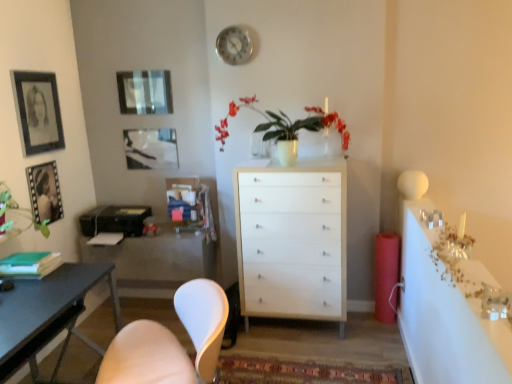
What do you see at coordinates (145, 92) in the screenshot?
I see `matte glass picture frame at upper center, the 3th picture frame positioned from the left` at bounding box center [145, 92].

Measure the distance between matte glass picture frame at upper center, the 3th picture frame positioned from the left, and camera.

matte glass picture frame at upper center, the 3th picture frame positioned from the left, is 3.05 meters away from camera.

In order to face black matte picture frame at upper left, which appears as the first picture frame when viewed from the left, should I rotate leftwards or rightwards?

Rotate your view left by about 26.527°.

The width and height of the screenshot is (512, 384). What do you see at coordinates (284, 123) in the screenshot?
I see `white glossy vase at center` at bounding box center [284, 123].

In order to click on matte white picture frame at upper left, the 1th picture frame from the right in this screenshot , I will do `click(150, 148)`.

Looking at this image, from a real-world perspective, is white matte chair at lower left physically below white glossy vase at center?

Indeed, from a real-world perspective, white matte chair at lower left is positioned beneath white glossy vase at center.

Is white matte chair at lower left taller or shorter than white glossy vase at center?

Clearly, white matte chair at lower left is taller compared to white glossy vase at center.

Looking at this image, is white matte chair at lower left thinner than white glossy vase at center?

Incorrect, the width of white matte chair at lower left is not less than that of white glossy vase at center.

Considering the points (140, 339) and (256, 108), which point is behind, point (140, 339) or point (256, 108)?

The point (256, 108) is farther from the camera.

Which is behind, point (287, 285) or point (122, 93)?

Point (122, 93)

From a real-world perspective, is white wood chest of drawers at center under matte glass picture frame at upper center, the 3th picture frame positioned from the left?

Yes, from a real-world perspective, white wood chest of drawers at center is beneath matte glass picture frame at upper center, the 3th picture frame positioned from the left.

From the image's perspective, which is below, white wood chest of drawers at center or matte glass picture frame at upper center, the 3th picture frame positioned from the left?

white wood chest of drawers at center is shown below in the image.

Does white wood chest of drawers at center appear on the right side of matte glass picture frame at upper center, the 3th picture frame positioned from the left?

Correct, you'll find white wood chest of drawers at center to the right of matte glass picture frame at upper center, the 3th picture frame positioned from the left.

Looking at this image, how many degrees apart are the facing directions of white glossy vase at center and matte glass picture frame at upper center, the 3th picture frame positioned from the left?

They differ by 0.0299 degrees in their facing directions.

Considering the sizes of objects white glossy vase at center and matte glass picture frame at upper center, the second picture frame from the right, in the image provided, who is smaller, white glossy vase at center or matte glass picture frame at upper center, the second picture frame from the right,?

matte glass picture frame at upper center, the second picture frame from the right, is smaller.

From a real-world perspective, which object stands above the other?

matte glass picture frame at upper center, the second picture frame from the right, from a real-world perspective.

From the image's perspective, is white glossy vase at center positioned above or below matte glass picture frame at upper center, the second picture frame from the right?

Clearly, from the image's perspective, white glossy vase at center is below matte glass picture frame at upper center, the second picture frame from the right.

From the image's perspective, is white glossy vase at center located beneath matte black picture frame at left, the 3th picture frame viewed from the right?

Actually, white glossy vase at center appears above matte black picture frame at left, the 3th picture frame viewed from the right, in the image.

In terms of size, does white glossy vase at center appear bigger or smaller than matte black picture frame at left, marked as the second picture frame in a left-to-right arrangement?

white glossy vase at center is bigger than matte black picture frame at left, marked as the second picture frame in a left-to-right arrangement.

How distant is white glossy vase at center from matte black picture frame at left, the 3th picture frame viewed from the right?

The distance of white glossy vase at center from matte black picture frame at left, the 3th picture frame viewed from the right, is 4.56 feet.

From a real-world perspective, who is located lower, white glossy vase at center or matte black picture frame at left, the 3th picture frame viewed from the right?

In real-world perspective, matte black picture frame at left, the 3th picture frame viewed from the right, is lower.

Can you tell me how much matte black picture frame at left, the 3th picture frame viewed from the right, and matte glass picture frame at upper center, the 3th picture frame positioned from the left, differ in facing direction?

90 degrees separate the facing orientations of matte black picture frame at left, the 3th picture frame viewed from the right, and matte glass picture frame at upper center, the 3th picture frame positioned from the left.

From the image's perspective, is matte black picture frame at left, marked as the second picture frame in a left-to-right arrangement, under matte glass picture frame at upper center, the 3th picture frame positioned from the left?

Yes.

Is matte black picture frame at left, the 3th picture frame viewed from the right, at the right side of matte glass picture frame at upper center, the second picture frame from the right?

In fact, matte black picture frame at left, the 3th picture frame viewed from the right, is to the left of matte glass picture frame at upper center, the second picture frame from the right.

How distant is matte black picture frame at left, marked as the second picture frame in a left-to-right arrangement, from matte glass picture frame at upper center, the second picture frame from the right?

The distance of matte black picture frame at left, marked as the second picture frame in a left-to-right arrangement, from matte glass picture frame at upper center, the second picture frame from the right, is 32.23 inches.

Does white glossy vase at center have a greater height compared to matte white picture frame at upper left, the 1th picture frame from the right?

Yes.

In terms of width, does white glossy vase at center look wider or thinner when compared to matte white picture frame at upper left, the 1th picture frame from the right?

In the image, white glossy vase at center appears to be wider than matte white picture frame at upper left, the 1th picture frame from the right.

Can we say white glossy vase at center lies outside matte white picture frame at upper left, which appears as the fourth picture frame when viewed from the left?

That's correct, white glossy vase at center is outside of matte white picture frame at upper left, which appears as the fourth picture frame when viewed from the left.

Which is behind, point (271, 120) or point (141, 164)?

The point (141, 164) is farther.

Find the location of `desk below the white wood chest of drawers at center (from a real-world perspective)`. desk below the white wood chest of drawers at center (from a real-world perspective) is located at coordinates (47, 310).

Between white wood chest of drawers at center and black metal desk at lower left, which one has more height?

Standing taller between the two is white wood chest of drawers at center.

Could you tell me if white wood chest of drawers at center is turned towards black metal desk at lower left?

No.

Locate an element on the screen. houseplant above the white matte chair at lower left (from a real-world perspective) is located at coordinates (284, 123).

Where is `the chest of drawers that appears below the matte glass picture frame at upper center, the second picture frame from the right (from the image's perspective)`? the chest of drawers that appears below the matte glass picture frame at upper center, the second picture frame from the right (from the image's perspective) is located at coordinates (293, 240).

Estimate the real-world distances between objects in this image. Which object is closer to white glossy countertop at right, white wood chest of drawers at center or metallic silver clock at upper center?

white wood chest of drawers at center lies closer to white glossy countertop at right than the other object.

Based on their spatial positions, is matte white picture frame at upper left, which appears as the fourth picture frame when viewed from the left, or matte black picture frame at left, marked as the second picture frame in a left-to-right arrangement, further from metallic silver clock at upper center?

matte black picture frame at left, marked as the second picture frame in a left-to-right arrangement, lies further to metallic silver clock at upper center than the other object.

Which object lies further to the anchor point black metal desk at lower left, matte glass picture frame at upper center, the second picture frame from the right, or white glossy countertop at right?

The object further to black metal desk at lower left is white glossy countertop at right.

Looking at this image, estimate the real-world distances between objects in this image. Which object is further from matte white picture frame at upper left, which appears as the fourth picture frame when viewed from the left, matte white cabinet at center or white matte chair at lower left?

Based on the image, white matte chair at lower left appears to be further to matte white picture frame at upper left, which appears as the fourth picture frame when viewed from the left.

Based on the photo, estimate the real-world distances between objects in this image. Which object is closer to white matte chair at lower left, matte glass picture frame at upper center, the 3th picture frame positioned from the left, or matte white picture frame at upper left, which appears as the fourth picture frame when viewed from the left?

matte white picture frame at upper left, which appears as the fourth picture frame when viewed from the left.

From the image, which object appears to be farther from matte white picture frame at upper left, which appears as the fourth picture frame when viewed from the left, matte black picture frame at left, marked as the second picture frame in a left-to-right arrangement, or matte white cabinet at center?

matte white cabinet at center.

When comparing their distances from metallic silver clock at upper center, does black metal desk at lower left or matte white cabinet at center seem closer?

matte white cabinet at center is positioned closer to the anchor metallic silver clock at upper center.

From the image, which object appears to be farther from matte white picture frame at upper left, the 1th picture frame from the right, white glossy countertop at right or metallic silver clock at upper center?

white glossy countertop at right.

Locate an element on the screen. The image size is (512, 384). chair between black matte picture frame at upper left, the fourth picture frame when ordered from right to left, and white glossy vase at center, in the horizontal direction is located at coordinates (170, 342).

Identify the location of chair between white glossy vase at center and black metal desk at lower left in the vertical direction. The height and width of the screenshot is (384, 512). (170, 342).

Find the location of a particular element. This screenshot has width=512, height=384. clock between white glossy countertop at right and matte white cabinet at center in the front-back direction is located at coordinates (234, 45).

Locate an element on the screen. The height and width of the screenshot is (384, 512). chest of drawers between black metal desk at lower left and white glossy countertop at right is located at coordinates (293, 240).